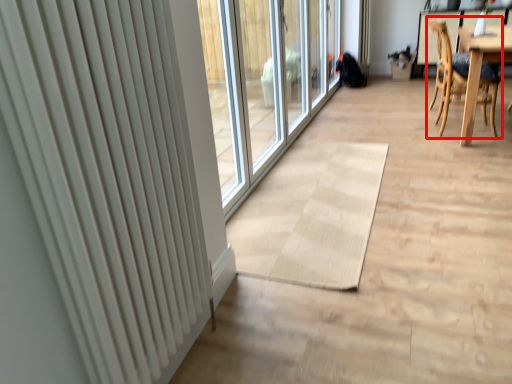
Question: Where is chair (annotated by the red box) located in relation to radiator in the image?

Choices:
 (A) left
 (B) right

Answer: (B)